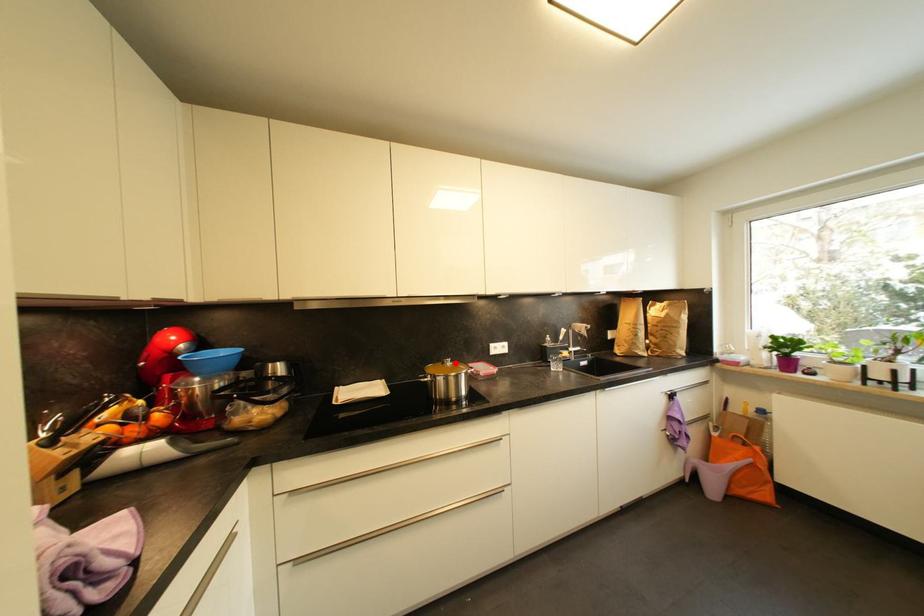
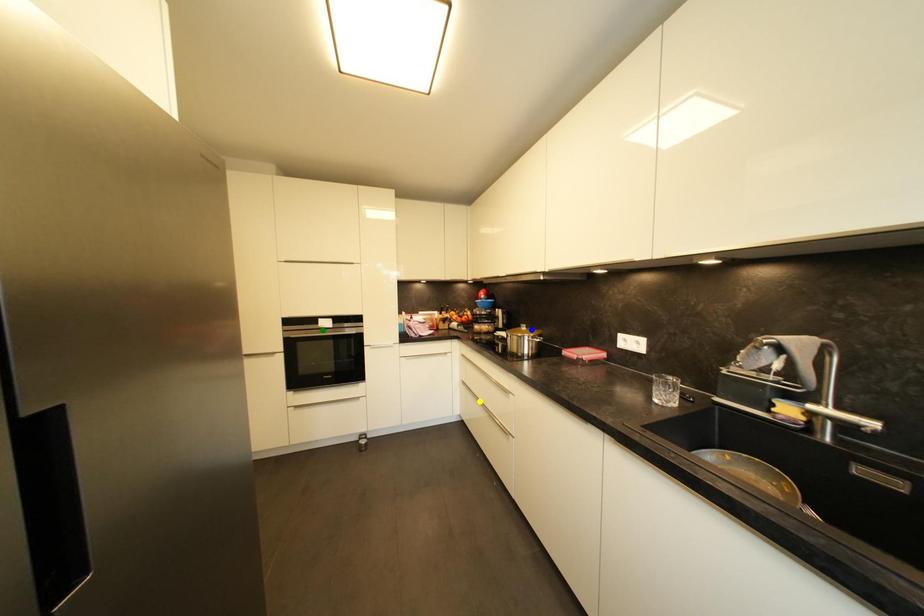
Question: I am providing you with two images of the same scene from different viewpoints. A red point is marked on the first image. You are given multiple points on the second image. Which point in image 2 is actually the same real-world point as the red point in image 1?

Choices:
 (A) green point
 (B) yellow point
 (C) blue point

Answer: (C)